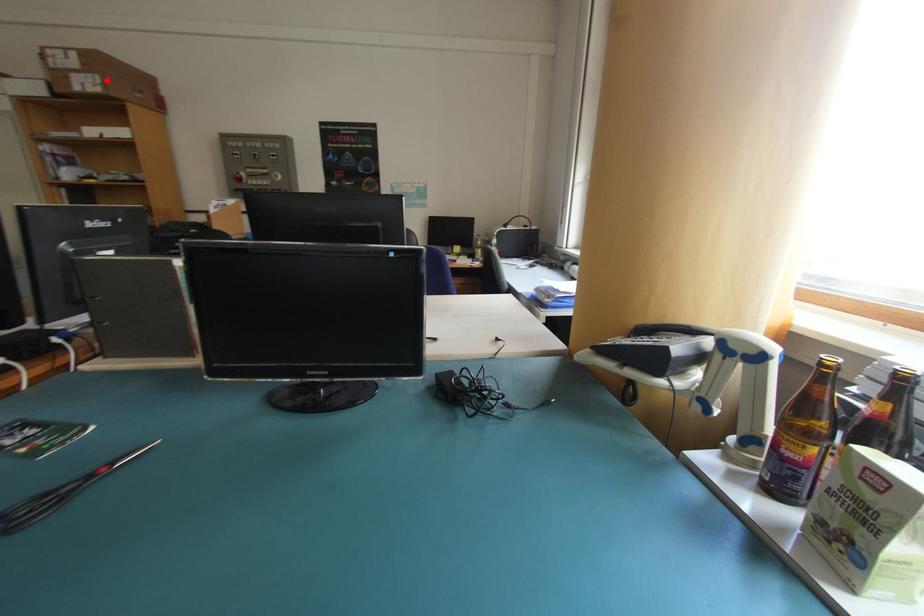
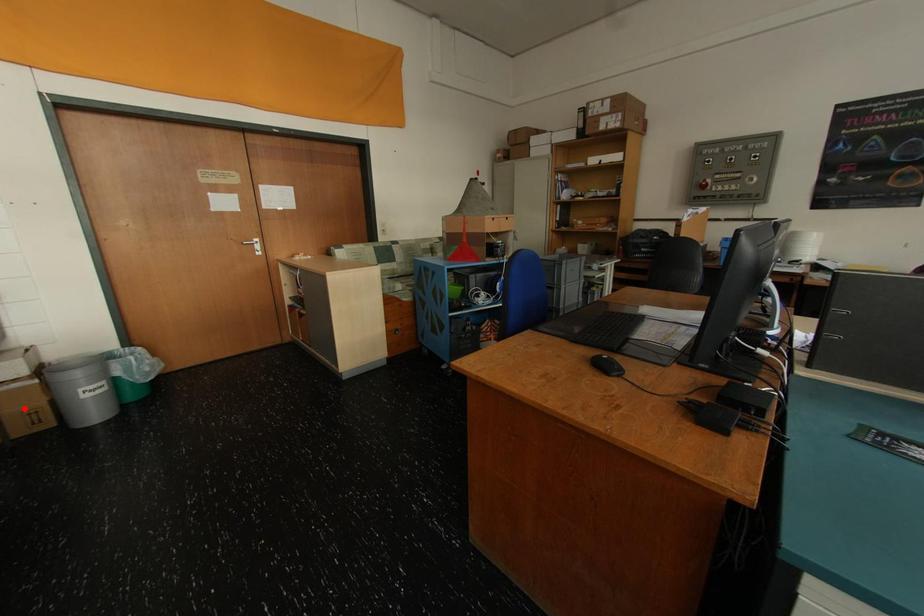
I am providing you with two images of the same scene from different viewpoints. A red point is marked on the first image and another point is marked on the second image. Is the red point in image1 aligned with the point shown in image2?

No